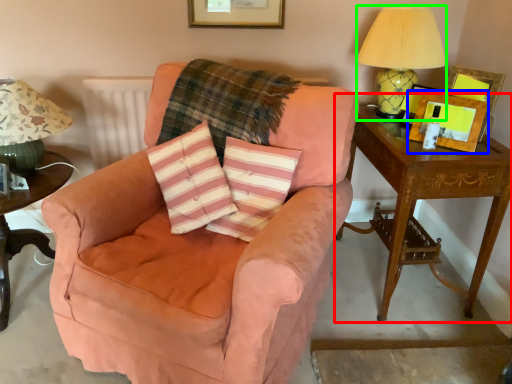
Question: Based on their relative distances, which object is nearer to table (highlighted by a red box)? Choose from picture frame (highlighted by a blue box) and table lamp (highlighted by a green box).

Choices:
 (A) picture frame
 (B) table lamp

Answer: (A)